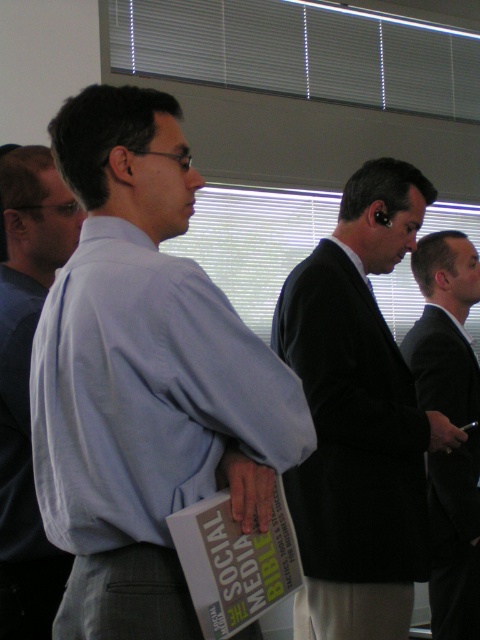
What is located at the coordinates point (359, 417)?

The dark suit at center is located at point (359, 417).

Based on the scene description, which object is taller, the dark suit at center or the light blue shirt at left?

The dark suit at center is taller than the light blue shirt at left according to the description.